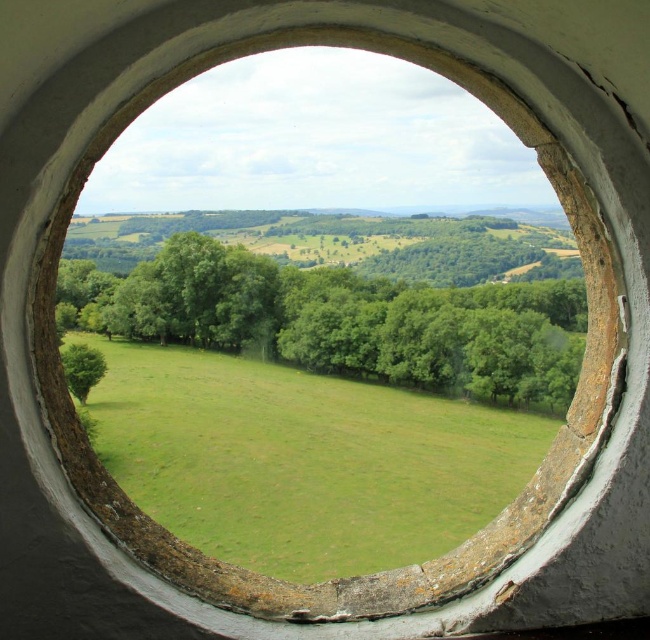
Is point (291, 529) farther from camera compared to point (255, 266)?

No, (291, 529) is in front of (255, 266).

Between green grassy field at center and green leafy tree at center, which one has more height?

green leafy tree at center

You are a GUI agent. You are given a task and a screenshot of the screen. Output one action in this format:
    pyautogui.click(x=<x>, y=<y>)
    Task: Click on the green grassy field at center
    The width and height of the screenshot is (650, 640).
    Given the screenshot: What is the action you would take?
    pyautogui.click(x=302, y=460)

I want to click on green grassy field at center, so click(302, 460).

Is point (99, 312) positioned before point (96, 353)?

No, it is not.

The width and height of the screenshot is (650, 640). Find the location of `green leafy tree at center`. green leafy tree at center is located at coordinates (351, 310).

This screenshot has height=640, width=650. Find the location of `green leafy tree at center`. green leafy tree at center is located at coordinates (351, 310).

Identify the location of green leafy tree at center. The height and width of the screenshot is (640, 650). (351, 310).

Does green grassy field at center have a greater height compared to green leafy tree at lower left?

Indeed, green grassy field at center has a greater height compared to green leafy tree at lower left.

Between green grassy field at center and green leafy tree at lower left, which one is positioned higher?

Positioned higher is green leafy tree at lower left.

Is point (244, 474) less distant than point (66, 358)?

Yes, point (244, 474) is in front of point (66, 358).

You are a GUI agent. You are given a task and a screenshot of the screen. Output one action in this format:
    pyautogui.click(x=<x>, y=<y>)
    Task: Click on the green grassy field at center
    This screenshot has height=640, width=650.
    Given the screenshot: What is the action you would take?
    pyautogui.click(x=302, y=460)